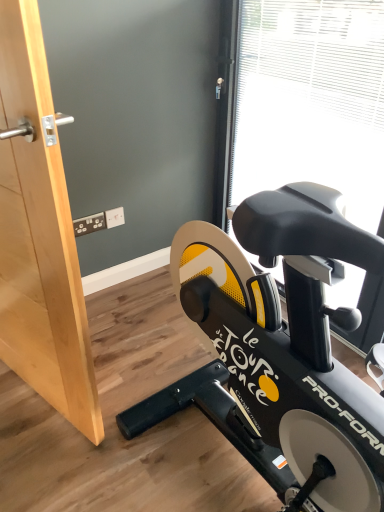
I want to click on wooden door at left, so (x=40, y=236).

At what (x,y) coordinates should I click in order to perform the action: click on transparent plastic window screen at upper right. Please return your answer as a coordinate pair (x, y). The width and height of the screenshot is (384, 512). Looking at the image, I should click on (312, 101).

Is black matte stationary bicycle at lower right not near wooden door at left?

No, black matte stationary bicycle at lower right is in close proximity to wooden door at left.

In terms of size, does black matte stationary bicycle at lower right appear bigger or smaller than wooden door at left?

In the image, black matte stationary bicycle at lower right appears to be smaller than wooden door at left.

Find the location of `screen door in front of the black matte stationary bicycle at lower right`. screen door in front of the black matte stationary bicycle at lower right is located at coordinates (40, 236).

Can you confirm if transparent plastic window screen at upper right is bigger than wooden door at left?

Correct, transparent plastic window screen at upper right is larger in size than wooden door at left.

From a real-world perspective, is transparent plastic window screen at upper right over wooden door at left?

No.

Does transparent plastic window screen at upper right have a greater width compared to wooden door at left?

Indeed, transparent plastic window screen at upper right has a greater width compared to wooden door at left.

How far apart are wooden door at left and black matte stationary bicycle at lower right?

wooden door at left and black matte stationary bicycle at lower right are 17.57 inches apart from each other.

Considering the positions of point (33, 226) and point (242, 426), is point (33, 226) closer or farther from the camera than point (242, 426)?

Point (33, 226) is closer to the camera than point (242, 426).

Considering the relative sizes of wooden door at left and black matte stationary bicycle at lower right in the image provided, is wooden door at left taller than black matte stationary bicycle at lower right?

Correct, wooden door at left is much taller as black matte stationary bicycle at lower right.

Considering the sizes of objects wooden door at left and black matte stationary bicycle at lower right in the image provided, who is wider, wooden door at left or black matte stationary bicycle at lower right?

black matte stationary bicycle at lower right.

From the image's perspective, which is above, transparent plastic window screen at upper right or black matte stationary bicycle at lower right?

transparent plastic window screen at upper right is shown above in the image.

The width and height of the screenshot is (384, 512). In the image, there is a black matte stationary bicycle at lower right. In order to click on window screen above it (from the image's perspective) in this screenshot , I will do `click(312, 101)`.

Based on the photo, from a real-world perspective, which is physically below, transparent plastic window screen at upper right or black matte stationary bicycle at lower right?

black matte stationary bicycle at lower right is physically lower.

Does transparent plastic window screen at upper right turn towards black matte stationary bicycle at lower right?

Yes, transparent plastic window screen at upper right is aimed at black matte stationary bicycle at lower right.

Is wooden door at left positioned far away from transparent plastic window screen at upper right?

Yes.

Does wooden door at left have a greater height compared to transparent plastic window screen at upper right?

No, wooden door at left is not taller than transparent plastic window screen at upper right.

Image resolution: width=384 pixels, height=512 pixels. Identify the location of screen door located on the left of transparent plastic window screen at upper right. (40, 236).

From a real-world perspective, is black matte stationary bicycle at lower right positioned under transparent plastic window screen at upper right based on gravity?

Yes, from a real-world perspective, black matte stationary bicycle at lower right is under transparent plastic window screen at upper right.

Which object is closer to the camera taking this photo, black matte stationary bicycle at lower right or transparent plastic window screen at upper right?

Positioned in front is black matte stationary bicycle at lower right.

Is black matte stationary bicycle at lower right bigger than transparent plastic window screen at upper right?

Incorrect, black matte stationary bicycle at lower right is not larger than transparent plastic window screen at upper right.

Image resolution: width=384 pixels, height=512 pixels. Identify the location of stationary bicycle on the right of wooden door at left. (280, 348).

At what (x,y) coordinates should I click in order to perform the action: click on screen door in front of the transparent plastic window screen at upper right. Please return your answer as a coordinate pair (x, y). Looking at the image, I should click on (40, 236).

Estimate the real-world distances between objects in this image. Which object is closer to black matte stationary bicycle at lower right, wooden door at left or transparent plastic window screen at upper right?

wooden door at left is closer to black matte stationary bicycle at lower right.

Estimate the real-world distances between objects in this image. Which object is closer to black matte stationary bicycle at lower right, transparent plastic window screen at upper right or wooden door at left?

wooden door at left lies closer to black matte stationary bicycle at lower right than the other object.

From the image, which object appears to be nearer to wooden door at left, transparent plastic window screen at upper right or black matte stationary bicycle at lower right?

Based on the image, black matte stationary bicycle at lower right appears to be nearer to wooden door at left.

Looking at the image, which one is located closer to wooden door at left, black matte stationary bicycle at lower right or transparent plastic window screen at upper right?

Based on the image, black matte stationary bicycle at lower right appears to be nearer to wooden door at left.

Which object lies nearer to the anchor point transparent plastic window screen at upper right, black matte stationary bicycle at lower right or wooden door at left?

black matte stationary bicycle at lower right is positioned closer to the anchor transparent plastic window screen at upper right.

From the picture: Considering their positions, is wooden door at left positioned further to transparent plastic window screen at upper right than black matte stationary bicycle at lower right?

wooden door at left lies further to transparent plastic window screen at upper right than the other object.

Where is `stationary bicycle between wooden door at left and transparent plastic window screen at upper right`? stationary bicycle between wooden door at left and transparent plastic window screen at upper right is located at coordinates (280, 348).